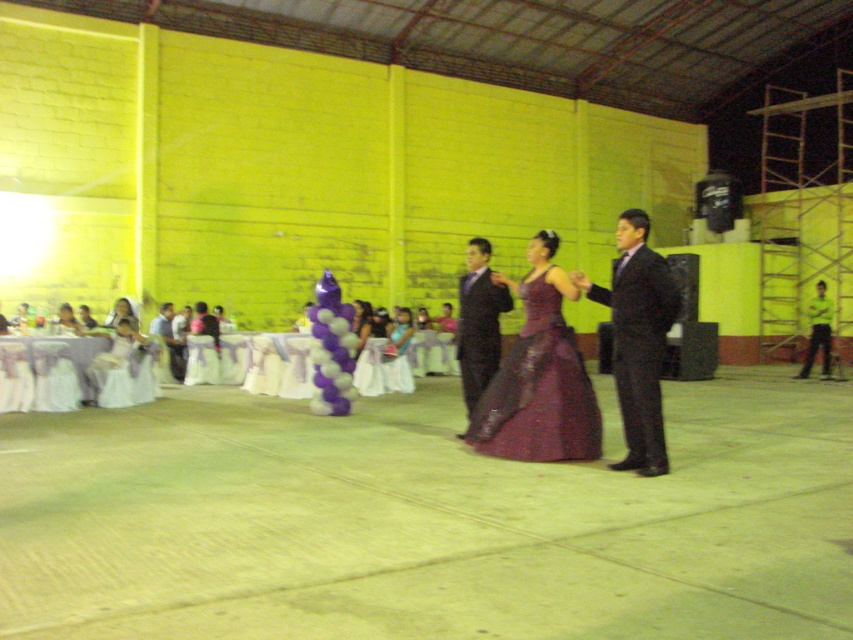
Between point (544, 301) and point (358, 336), which one is positioned behind?

Point (358, 336)

Is shiny purple gown at center positioned at the back of satin purple dress at center?

No, shiny purple gown at center is in front of satin purple dress at center.

Is point (561, 371) closer to viewer compared to point (369, 330)?

Yes, point (561, 371) is in front of point (369, 330).

The image size is (853, 640). I want to click on shiny purple gown at center, so click(x=538, y=388).

Does matte black suit at center have a larger size compared to green fabric pants at center?

No.

Identify the location of matte black suit at center. This screenshot has width=853, height=640. (479, 323).

Consider the image. Is matte black suit at center above matte black suit at left?

Indeed, matte black suit at center is positioned over matte black suit at left.

Who is more forward, (486, 250) or (161, 308)?

Point (486, 250)

Identify the location of matte black suit at center. (479, 323).

Image resolution: width=853 pixels, height=640 pixels. What are the coordinates of `matte black suit at center` in the screenshot? It's located at (479, 323).